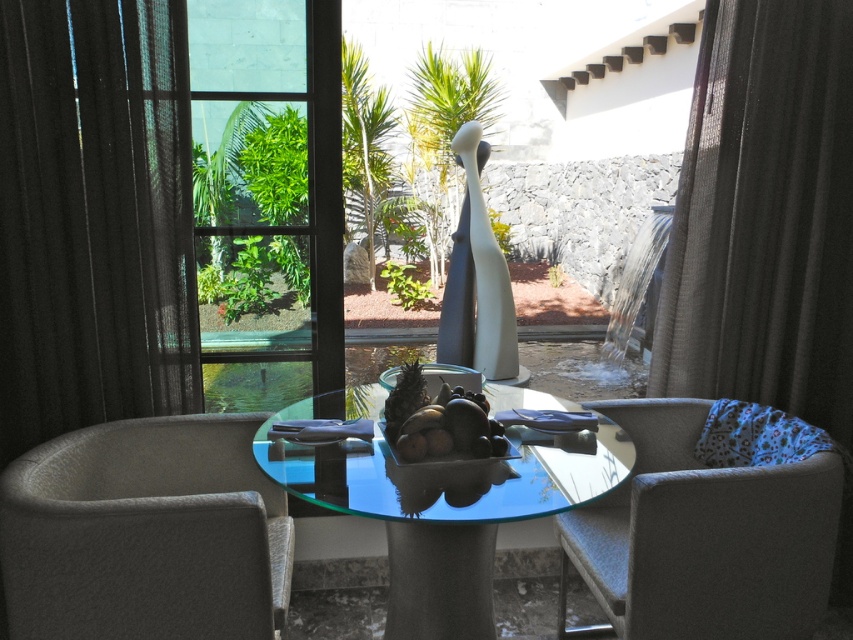
You are planning to hang a new curtain that is the same size as the transparent glass door at left. Can the black sheer curtain at right be used as a replacement?

The black sheer curtain at right is bigger than the transparent glass door at left, so it cannot be used as a replacement since it is larger than the required size.

You are a delivery person carrying a large box that is 1.5 meters wide. You need to enter through the transparent glass door at left but must pass by the black sheer curtain at right. Can you fit through the space between them without touching either?

The distance between the black sheer curtain at right and the transparent glass door at left is 1.29 meters, which is narrower than the box width of 1.5 meters. Therefore, the box cannot fit through the space between them without touching either object.

You are planning to install a new lighting fixture that requires 40 inches of clearance between the black sheer curtain at right and the transparent glass table at center. Based on the scene, will there be enough space for the installation?

The black sheer curtain at right is 36.89 inches from the transparent glass table at center, which is less than the required 40 inches clearance. Therefore, there is insufficient space for the installation.